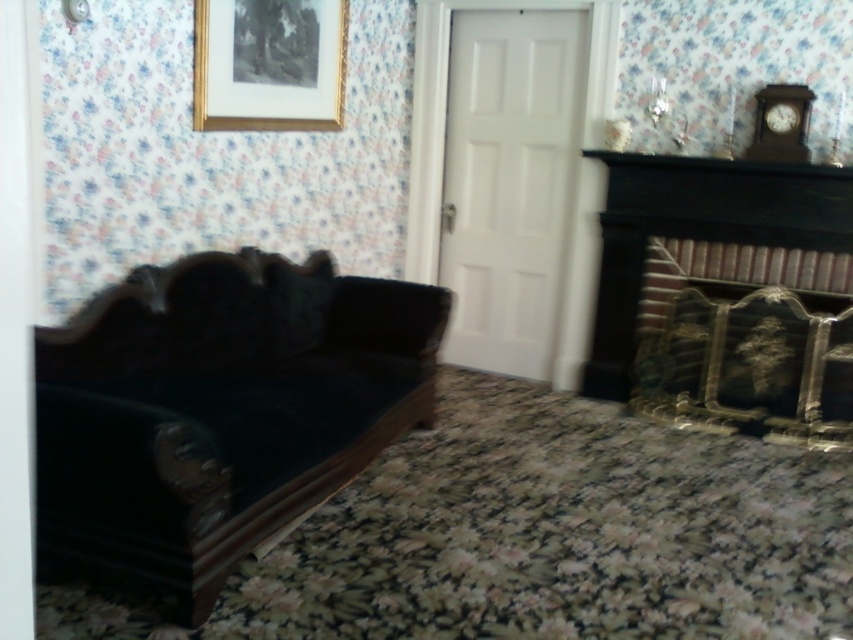
Question: Which object appears farthest from the camera in this image?

Choices:
 (A) velvet dark brown couch at lower left
 (B) black brick fireplace at right
 (C) velvety black pillow at center
 (D) gold-framed print at upper center

Answer: (B)

Question: Which of the following is the farthest from the observer?

Choices:
 (A) black brick fireplace at right
 (B) gold-framed print at upper center

Answer: (A)

Question: Is velvet dark brown couch at lower left closer to camera compared to black brick fireplace at right?

Choices:
 (A) yes
 (B) no

Answer: (A)

Question: Does velvet dark brown couch at lower left have a larger size compared to velvety black pillow at center?

Choices:
 (A) no
 (B) yes

Answer: (B)

Question: Does black brick fireplace at right have a smaller size compared to gold-framed print at upper center?

Choices:
 (A) yes
 (B) no

Answer: (B)

Question: Which object is closer to the camera taking this photo?

Choices:
 (A) velvety black pillow at center
 (B) velvet dark brown couch at lower left
 (C) black brick fireplace at right
 (D) gold-framed print at upper center

Answer: (B)